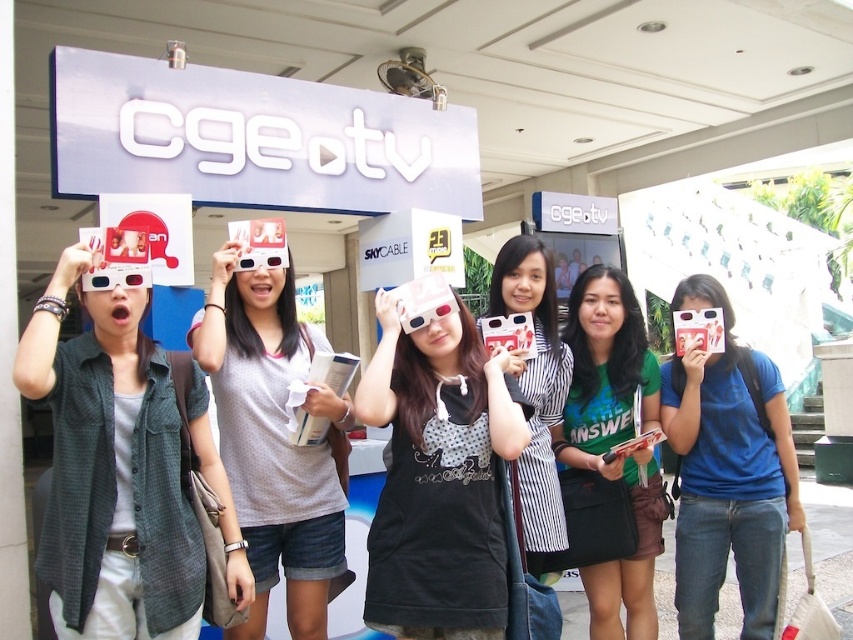
You are a photographer at the event and want to ensure that both the white matte tank top at center and the green matte shirt at center are clearly visible in the photo. Which clothing item should you focus on first to capture both in the frame?

The white matte tank top at center is located above the green matte shirt at center, so focusing on the white matte tank top at center first will ensure both are in the frame as the green matte shirt at center is below it.

You are a photographer at the event and want to take a photo of the matte black dress at center and the green matte shirt at center. The camera has a minimum focus distance of 30 inches. Will both subjects be in focus?

The matte black dress at center is 28.61 inches away from green matte shirt at center. Since the distance between them is less than the camera minimum focus distance of 30 inches, the camera cannot focus on both subjects simultaneously.